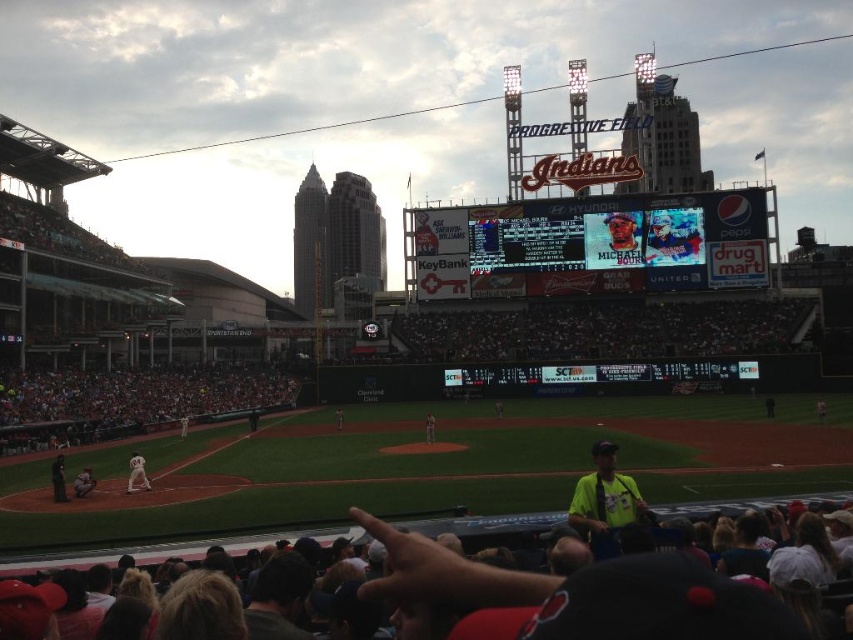
You are a photographer at Progressive Field and want to capture both the green jersey at lower left and the matte gray uniform at lower left in a single shot. Based on their positions, which one is positioned further to the left in the frame?

The green jersey at lower left is positioned further to the left compared to the matte gray uniform at lower left.

You are a photographer standing at the edge of the field. You need to take a photo that includes both the green jersey at lower left and the white uniform at center. Which one will appear larger in the photo?

The green jersey at lower left will appear larger in the photo because it is much taller than the white uniform at center.

You are a drone operator assigned to capture aerial footage of the Progressive Field baseball game. Your drone must stay above the field at all times. The point at coordinates point (51,464) is part of the field. If your drone is currently 100 meters away from the camera, can it safely hover above this point without violating the field airspace rules?

The distance of point (51,464) from camera is 104.79 meters. Since the drone is currently 100 meters away from the camera, it needs to move an additional 4.79 meters forward to reach the point and hover above it while staying within the field airspace rules.